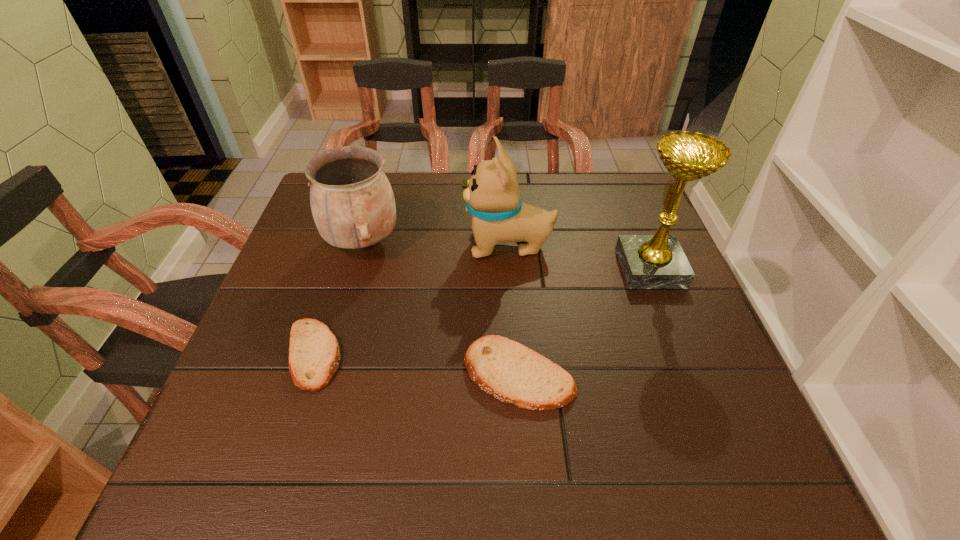
Locate an element on the screen. Image resolution: width=960 pixels, height=540 pixels. object at the far left corner is located at coordinates (352, 202).

This screenshot has height=540, width=960. I want to click on object present at the near left corner, so point(314,355).

Identify the location of vacant space at the far edge of the desktop. This screenshot has width=960, height=540. (428, 174).

In the image, there is a desktop. At what (x,y) coordinates should I click in order to perform the action: click on free region at the near edge. Please return your answer as a coordinate pair (x, y). Image resolution: width=960 pixels, height=540 pixels. Looking at the image, I should click on (644, 427).

In the image, there is a desktop. Find the location of `vacant space at the left edge`. vacant space at the left edge is located at coordinates (273, 303).

Where is `vacant space at the right edge of the desktop`? This screenshot has height=540, width=960. vacant space at the right edge of the desktop is located at coordinates (617, 287).

This screenshot has width=960, height=540. I want to click on vacant space at the far right corner, so click(642, 204).

In the image, there is a desktop. Identify the location of vacant region at the near right corner. This screenshot has height=540, width=960. (710, 394).

The width and height of the screenshot is (960, 540). In order to click on free area in between the rightmost object and the fourth shortest object in this screenshot , I will do `click(579, 256)`.

At what (x,y) coordinates should I click in order to perform the action: click on vacant area that lies between the left pita bread and the second tallest object. Please return your answer as a coordinate pair (x, y). This screenshot has height=540, width=960. Looking at the image, I should click on (411, 300).